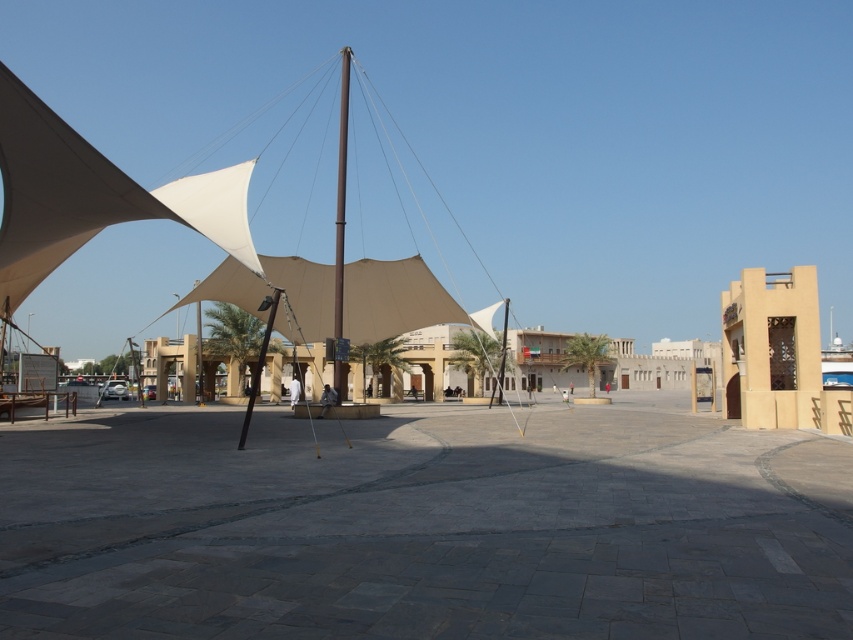
You are standing in the plaza and want to walk from the black metal pole at center to the smooth stone pavement at center. Which direction should you face before stepping forward?

A: The smooth stone pavement at center is to the right of the black metal pole at center, so you should face to the right direction before stepping forward.

You are planning to place a decorative banner around the pole in the plaza. The banner is designed to fit around a pole with a circumference of 1.2 meters. Which pole, the smooth gray pole at center or the black metal pole at center, is more suitable for the banner?

The smooth gray pole at center is thinner than the black metal pole at center, so the banner designed for a 1.2 meter circumference would fit better around the smooth gray pole at center.

You are standing in the plaza and want to walk towards the black metal pole at center. Which direction should you move relative to the smooth stone pavement at center?

Since the smooth stone pavement at center is in front of the black metal pole at center, you should move backward away from the smooth stone pavement at center to reach the black metal pole at center.